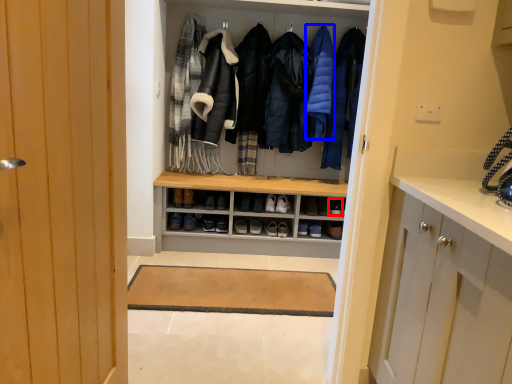
Question: Which object appears farthest to the camera in this image, shoe (highlighted by a red box) or garment (highlighted by a blue box)?

Choices:
 (A) shoe
 (B) garment

Answer: (A)